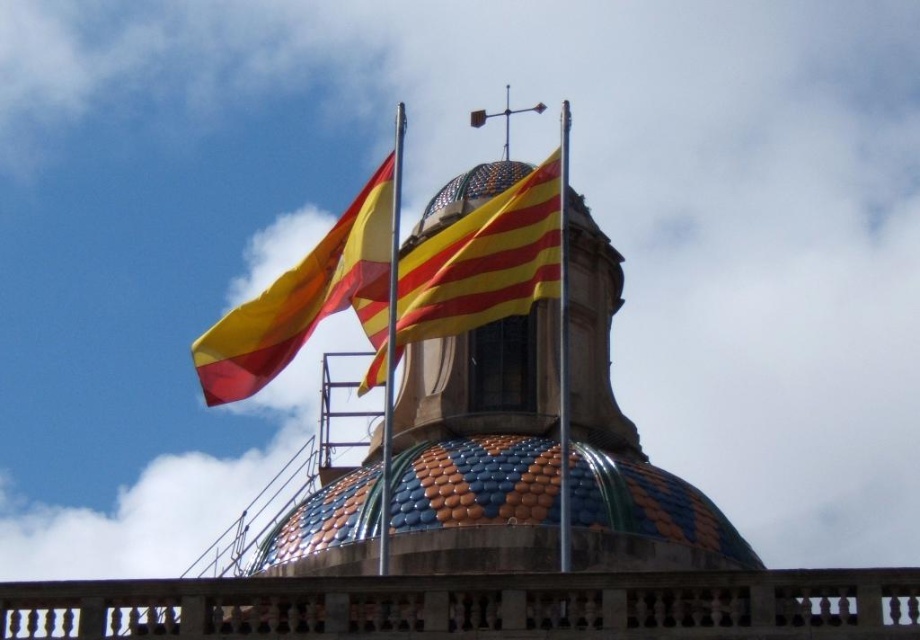
Question: Is yellowstriped fabricflag at center thinner than metallic pole at center?

Choices:
 (A) no
 (B) yes

Answer: (A)

Question: Is yellow-red striped fabric flag at upper left wider than metallic pole at center?

Choices:
 (A) no
 (B) yes

Answer: (B)

Question: Estimate the real-world distances between objects in this image. Which object is farther from the metallic pole at center?

Choices:
 (A) yellowstriped fabricflag at center
 (B) yellow-red striped fabric flag at upper left

Answer: (B)

Question: Is yellow-red striped fabric flag at upper left closer to camera compared to metallic pole at center?

Choices:
 (A) yes
 (B) no

Answer: (B)

Question: Considering the real-world distances, which object is farthest from the yellow-red striped fabric flag at upper left?

Choices:
 (A) metallic pole at center
 (B) yellowstriped fabricflag at center

Answer: (B)

Question: Among these points, which one is farthest from the camera?

Choices:
 (A) (227, 362)
 (B) (393, 266)
 (C) (478, 243)

Answer: (A)